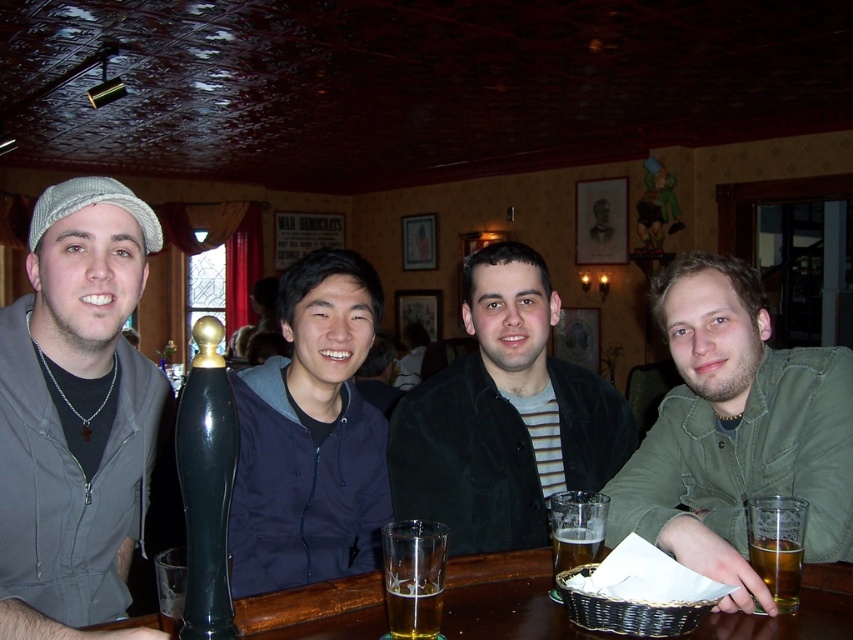
Is navy blue jacket at center thinner than golden amber liquid at lower right?

No.

Is point (294, 291) closer to viewer compared to point (759, 576)?

No, (294, 291) is further to viewer.

This screenshot has width=853, height=640. What are the coordinates of `navy blue jacket at center` in the screenshot? It's located at (310, 435).

Based on the photo, is matte gray cap at left to the left of black glossy beer tap at center from the viewer's perspective?

Indeed, matte gray cap at left is positioned on the left side of black glossy beer tap at center.

Measure the distance between matte gray cap at left and camera.

A distance of 37.18 inches exists between matte gray cap at left and camera.

What do you see at coordinates (74, 416) in the screenshot? The height and width of the screenshot is (640, 853). I see `matte gray cap at left` at bounding box center [74, 416].

You are a GUI agent. You are given a task and a screenshot of the screen. Output one action in this format:
    pyautogui.click(x=<x>, y=<y>)
    Task: Click on the matte gray cap at left
    Image resolution: width=853 pixels, height=640 pixels.
    Given the screenshot: What is the action you would take?
    pyautogui.click(x=74, y=416)

Is point (289, 579) behind point (416, 636)?

That is True.

Does point (381, 474) lie in front of point (412, 612)?

No, it is not.

You are a GUI agent. You are given a task and a screenshot of the screen. Output one action in this format:
    pyautogui.click(x=<x>, y=<y>)
    Task: Click on the navy blue jacket at center
    
    Given the screenshot: What is the action you would take?
    pyautogui.click(x=310, y=435)